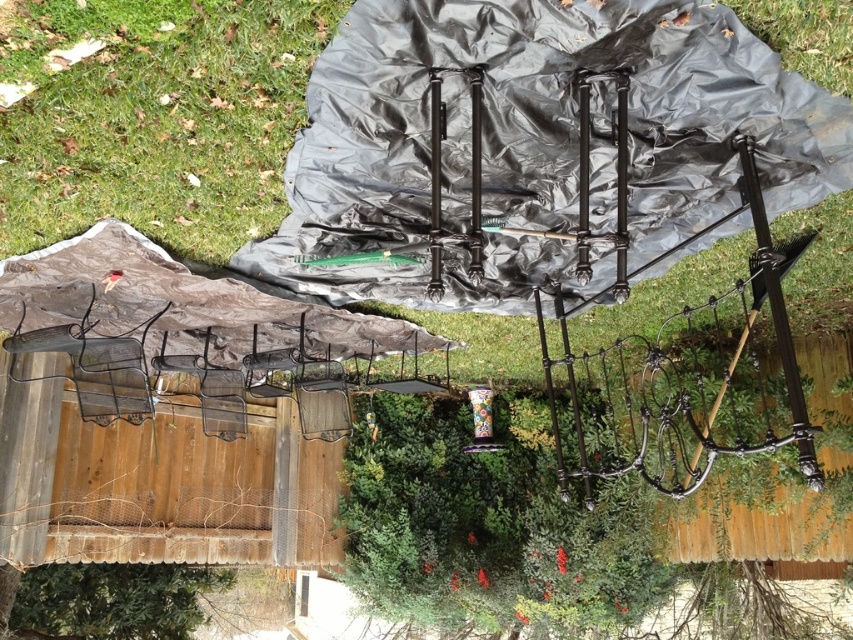
Question: Is black plastic blanket at center further to the viewer compared to green grass at upper left?

Choices:
 (A) yes
 (B) no

Answer: (A)

Question: Is black plastic blanket at center above green grass at upper left?

Choices:
 (A) yes
 (B) no

Answer: (B)

Question: Can you confirm if black plastic blanket at center is smaller than green grass at upper left?

Choices:
 (A) yes
 (B) no

Answer: (B)